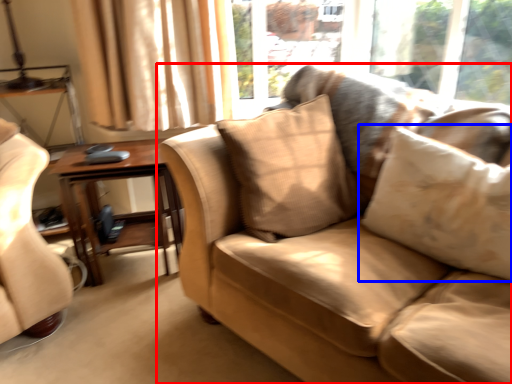
Question: Which object is closer to the camera taking this photo, studio couch (highlighted by a red box) or pillow (highlighted by a blue box)?

Choices:
 (A) studio couch
 (B) pillow

Answer: (A)